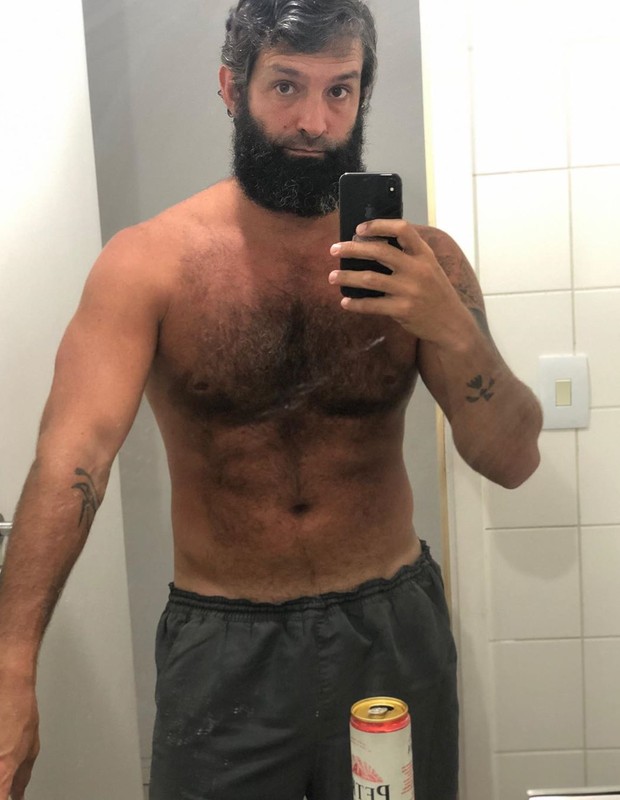
This screenshot has width=620, height=800. Find the location of `this man is taking a mirror selfie in the bathroom`. this man is taking a mirror selfie in the bathroom is located at coordinates (289, 218).